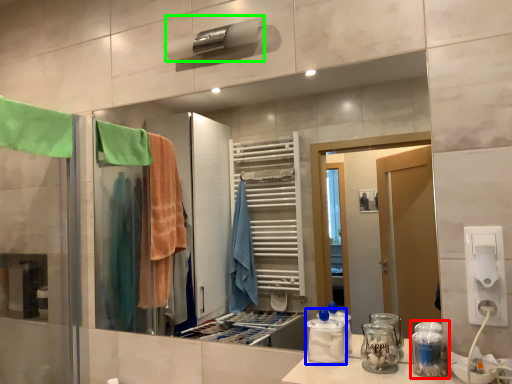
Question: Which object is the farthest from glass jar (highlighted by a red box)? Choose among these: bottle (highlighted by a blue box) or towel bar (highlighted by a green box).

Choices:
 (A) bottle
 (B) towel bar

Answer: (B)